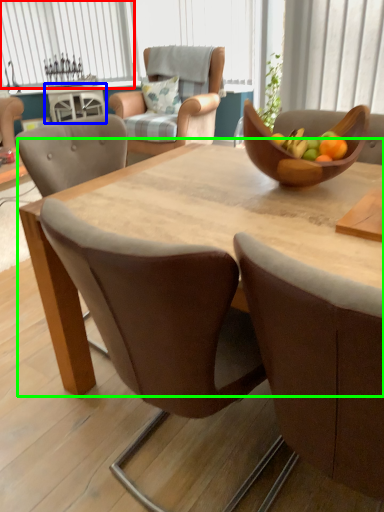
Question: Considering the real-world distances, which object is closest to window (highlighted by a red box)? coffee table (highlighted by a blue box) or round table (highlighted by a green box).

Choices:
 (A) coffee table
 (B) round table

Answer: (A)